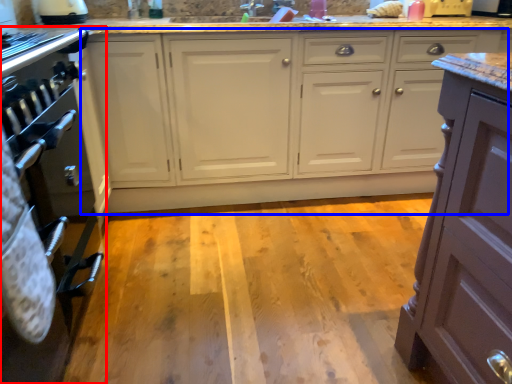
Question: Among these objects, which one is farthest to the camera, home appliance (highlighted by a red box) or cabinetry (highlighted by a blue box)?

Choices:
 (A) home appliance
 (B) cabinetry

Answer: (B)